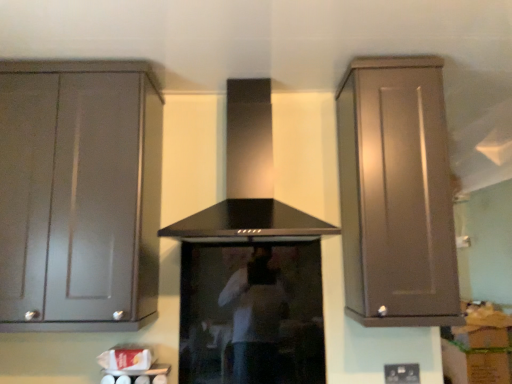
Question: Does point (415, 375) appear closer or farther from the camera than point (314, 283)?

Choices:
 (A) closer
 (B) farther

Answer: (A)

Question: Is black plastic electric outlet at lower center spatially inside black glass stove at center, or outside of it?

Choices:
 (A) inside
 (B) outside

Answer: (B)

Question: Which object is positioned closest to the black glass stove at center?

Choices:
 (A) black plastic electric outlet at lower center
 (B) black matte vent at center
 (C) matte brown cabinet at right, which is counted as the 2th cabinetry, starting from the left
 (D) matte gray cabinet at left, arranged as the first cabinetry when viewed from the left

Answer: (B)

Question: Which of these objects is positioned farthest from the matte brown cabinet at right, marked as the 1th cabinetry in a right-to-left arrangement?

Choices:
 (A) matte gray cabinet at left, arranged as the first cabinetry when viewed from the left
 (B) black matte vent at center
 (C) black plastic electric outlet at lower center
 (D) black glass stove at center

Answer: (A)